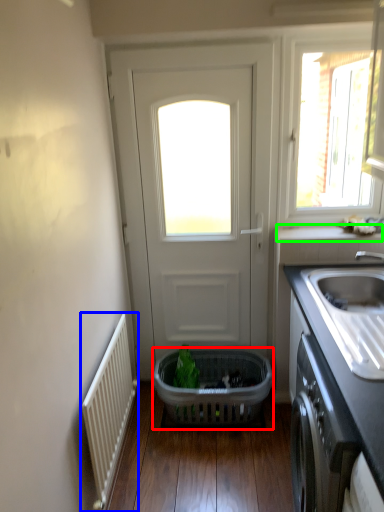
Question: Based on their relative distances, which object is farther from basket (highlighted by a red box)? Choose from radiator (highlighted by a blue box) and window sill (highlighted by a green box).

Choices:
 (A) radiator
 (B) window sill

Answer: (B)